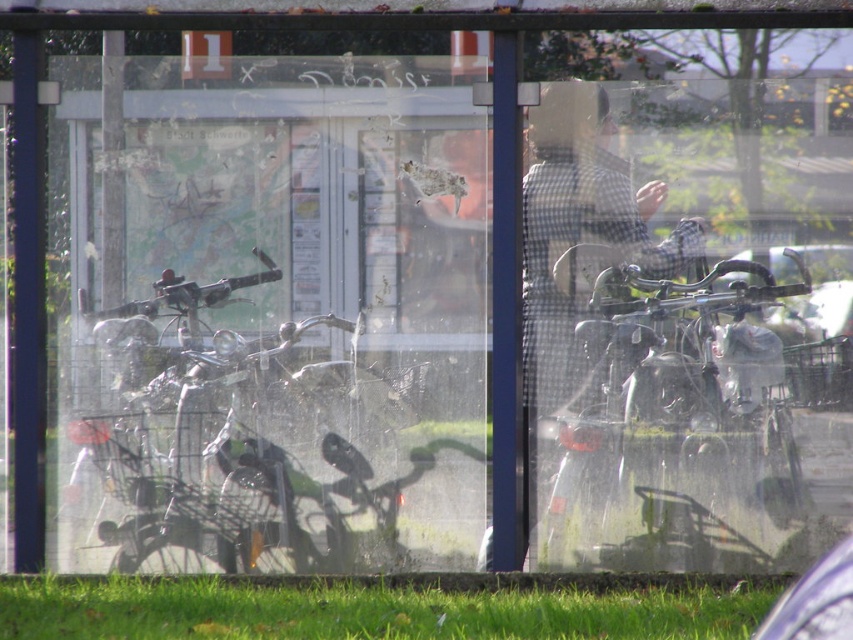
You are a security guard at the bus stop shelter. You notice the green grass at lower center and the metallic gun at left. Which object is positioned lower in the scene?

The green grass at lower center is located below the metallic gun at left, so it is positioned lower in the scene.

You are a delivery person with a 10 inch wide box that needs to be placed between the metallic silver motorcycle at left and the metallic gun at left. Can the box fit between them without overlapping either object?

The metallic silver motorcycle at left and metallic gun at left are 9.59 inches apart from each other. Since the box is 10 inches wide, it cannot fit between them as the space is slightly narrower than the box.

You are at the bus stop and want to know if the metallic silver motorcycle at left can fit in the space where the green grass at lower center is currently located. Can it fit?

The metallic silver motorcycle at left is smaller than green grass at lower center, so it can fit in the space where the green grass is located.